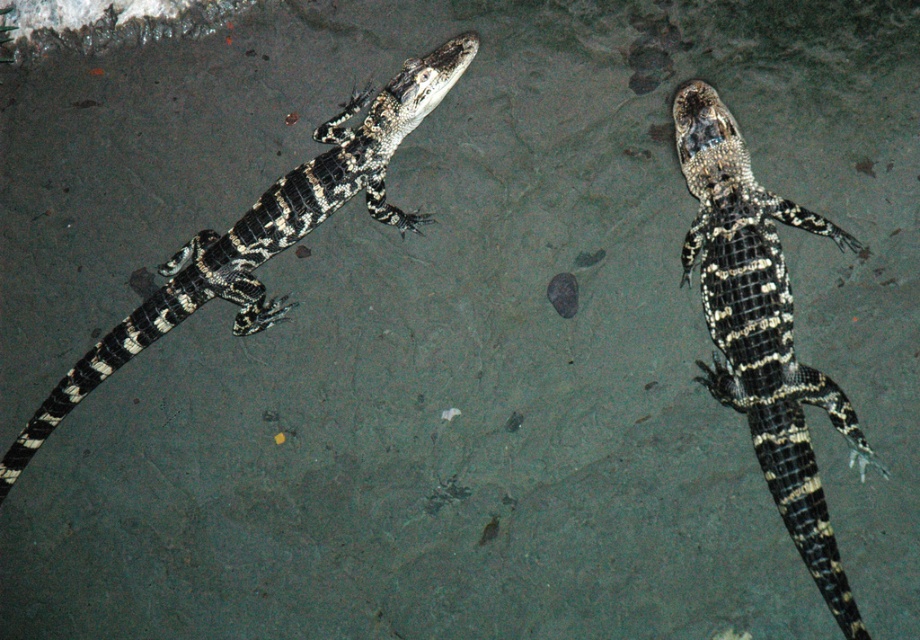
Question: Is shiny black scales at upper right in front of shiny black scales at left?

Choices:
 (A) yes
 (B) no

Answer: (A)

Question: Which object appears farthest from the camera in this image?

Choices:
 (A) shiny black scales at upper right
 (B) shiny black scales at left

Answer: (B)

Question: Is shiny black scales at upper right closer to the viewer compared to shiny black scales at left?

Choices:
 (A) yes
 (B) no

Answer: (A)

Question: Among these objects, which one is farthest from the camera?

Choices:
 (A) shiny black scales at upper right
 (B) shiny black scales at left

Answer: (B)

Question: Does shiny black scales at upper right have a larger size compared to shiny black scales at left?

Choices:
 (A) no
 (B) yes

Answer: (A)